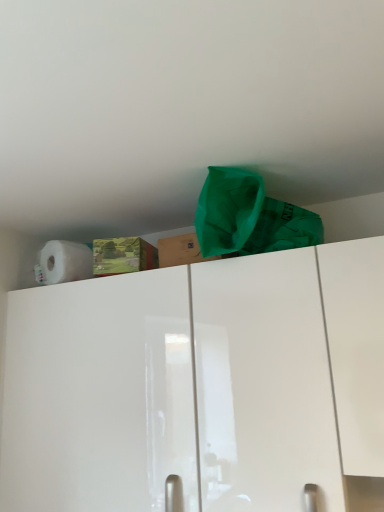
This screenshot has width=384, height=512. I want to click on green fabric bag at upper center, so click(x=249, y=217).

What is the approximate height of green fabric bag at upper center?

The height of green fabric bag at upper center is 7.34 inches.

Locate an element on the screen. green fabric bag at upper center is located at coordinates (249, 217).

Which object is thinner, brown cardboard box at upper center or white matte paper towel at upper left?

Thinner between the two is white matte paper towel at upper left.

Do you think brown cardboard box at upper center is within white matte paper towel at upper left, or outside of it?

brown cardboard box at upper center is not enclosed by white matte paper towel at upper left.

I want to click on paper towel below the brown cardboard box at upper center (from the image's perspective), so click(64, 262).

Is brown cardboard box at upper center smaller than white matte paper towel at upper left?

Correct, brown cardboard box at upper center occupies less space than white matte paper towel at upper left.

Based on the photo, which object is positioned more to the right, white matte paper towel at upper left or brown cardboard box at upper center?

brown cardboard box at upper center.

Does white matte paper towel at upper left have a lesser width compared to brown cardboard box at upper center?

Indeed, white matte paper towel at upper left has a lesser width compared to brown cardboard box at upper center.

Is white matte paper towel at upper left looking in the opposite direction of brown cardboard box at upper center?

No, brown cardboard box at upper center is not at the back of white matte paper towel at upper left.

Is point (83, 252) in front of point (164, 265)?

No.

Does green fabric bag at upper center contain brown cardboard box at upper center?

No.

Can you confirm if green fabric bag at upper center is wider than brown cardboard box at upper center?

Correct, the width of green fabric bag at upper center exceeds that of brown cardboard box at upper center.

What's the angular difference between green fabric bag at upper center and brown cardboard box at upper center's facing directions?

The facing directions of green fabric bag at upper center and brown cardboard box at upper center are 0.0118 degrees apart.

From a real-world perspective, is green fabric bag at upper center above or below white matte paper towel at upper left?

green fabric bag at upper center is situated higher than white matte paper towel at upper left in the real world.

From the image's perspective, which is above, green fabric bag at upper center or white matte paper towel at upper left?

From the image's view, green fabric bag at upper center is above.

Is white matte paper towel at upper left surrounded by green fabric bag at upper center?

No, white matte paper towel at upper left is not surrounded by green fabric bag at upper center.

In terms of size, does white matte paper towel at upper left appear bigger or smaller than white glossy cabinet at upper center?

Clearly, white matte paper towel at upper left is smaller in size than white glossy cabinet at upper center.

Considering the positions of point (66, 245) and point (131, 368), is point (66, 245) closer or farther from the camera than point (131, 368)?

Point (66, 245) is farther from the camera than point (131, 368).

From the picture: Could you tell me if white matte paper towel at upper left is facing white glossy cabinet at upper center?

No.

Does white matte paper towel at upper left appear on the right side of white glossy cabinet at upper center?

No.

In the image, is brown cardboard box at upper center positioned in front of or behind green fabric bag at upper center?

brown cardboard box at upper center is positioned farther from the viewer than green fabric bag at upper center.

From the image's perspective, is brown cardboard box at upper center under green fabric bag at upper center?

Yes, from the image's perspective, brown cardboard box at upper center is beneath green fabric bag at upper center.

Is brown cardboard box at upper center positioned with its back to green fabric bag at upper center?

No, brown cardboard box at upper center is not facing away from green fabric bag at upper center.

Can you confirm if brown cardboard box at upper center is shorter than green fabric bag at upper center?

Yes, brown cardboard box at upper center is shorter than green fabric bag at upper center.

Is white matte paper towel at upper left surrounded by white glossy cabinet at upper center?

No, white matte paper towel at upper left is not surrounded by white glossy cabinet at upper center.

Considering the relative positions of white glossy cabinet at upper center and white matte paper towel at upper left in the image provided, is white glossy cabinet at upper center behind white matte paper towel at upper left?

No.

Between point (93, 413) and point (56, 245), which one is positioned behind?

Positioned behind is point (56, 245).

The width and height of the screenshot is (384, 512). Identify the location of paper towel above the brown cardboard box at upper center (from a real-world perspective). (64, 262).

What are the coordinates of `paper towel on the left of brown cardboard box at upper center` in the screenshot? It's located at (64, 262).

Considering their positions, is white glossy cabinet at upper center positioned closer to white matte paper towel at upper left than green fabric bag at upper center?

white glossy cabinet at upper center lies closer to white matte paper towel at upper left than the other object.

Looking at the image, which one is located closer to white glossy cabinet at upper center, green fabric bag at upper center or brown cardboard box at upper center?

green fabric bag at upper center is positioned closer to the anchor white glossy cabinet at upper center.

Which object lies further to the anchor point brown cardboard box at upper center, white glossy cabinet at upper center or green fabric bag at upper center?

white glossy cabinet at upper center is positioned further to the anchor brown cardboard box at upper center.

When comparing their distances from brown cardboard box at upper center, does green fabric bag at upper center or white glossy cabinet at upper center seem closer?

Based on the image, green fabric bag at upper center appears to be nearer to brown cardboard box at upper center.

Which object lies further to the anchor point white glossy cabinet at upper center, white matte paper towel at upper left or green fabric bag at upper center?

The object further to white glossy cabinet at upper center is white matte paper towel at upper left.

Based on their spatial positions, is white glossy cabinet at upper center or white matte paper towel at upper left further from brown cardboard box at upper center?

white glossy cabinet at upper center lies further to brown cardboard box at upper center than the other object.

Based on the photo, which object lies nearer to the anchor point brown cardboard box at upper center, green fabric bag at upper center or white matte paper towel at upper left?

green fabric bag at upper center.

From the picture: Considering their positions, is white glossy cabinet at upper center positioned further to white matte paper towel at upper left than brown cardboard box at upper center?

The object further to white matte paper towel at upper left is white glossy cabinet at upper center.

Identify the location of cardboard box between white matte paper towel at upper left and green fabric bag at upper center. This screenshot has width=384, height=512. (180, 251).

At what (x,y) coordinates should I click in order to perform the action: click on cabinetry situated between white matte paper towel at upper left and green fabric bag at upper center from left to right. Please return your answer as a coordinate pair (x, y). Looking at the image, I should click on (198, 385).

Find the location of a particular element. The image size is (384, 512). cardboard box that lies between green fabric bag at upper center and white glossy cabinet at upper center from top to bottom is located at coordinates (180, 251).

This screenshot has width=384, height=512. Identify the location of cardboard box between white glossy cabinet at upper center and white matte paper towel at upper left from front to back. (180, 251).